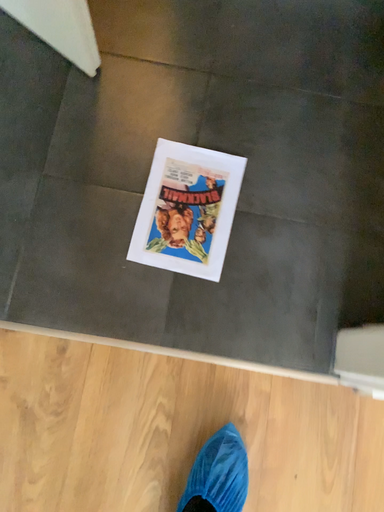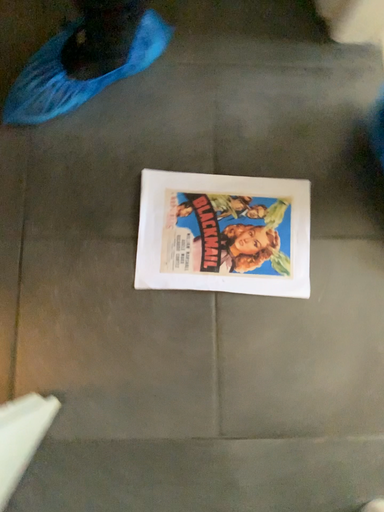
Question: How did the camera likely rotate when shooting the video?

Choices:
 (A) rotated left
 (B) rotated right

Answer: (B)